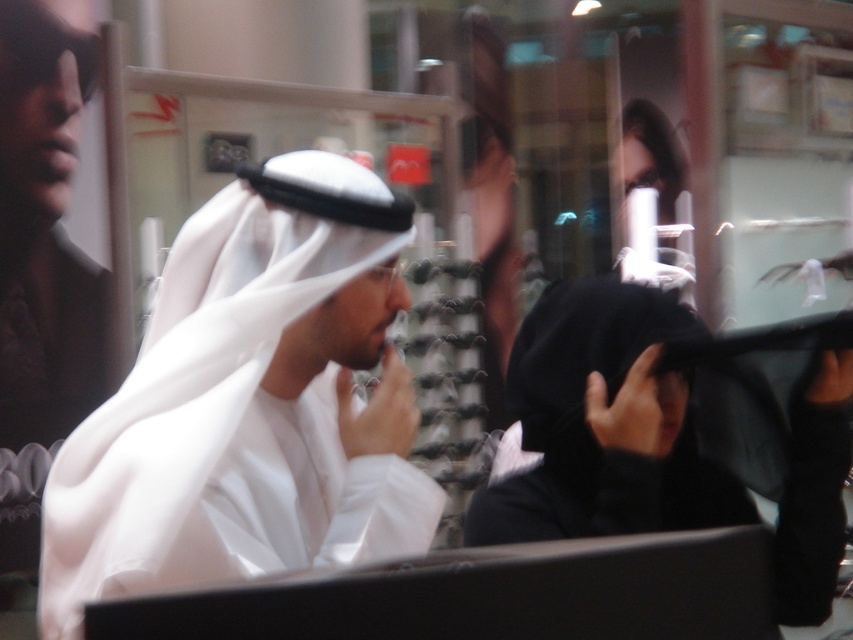
Looking at this image, based on the scene described, which object among the white matte headscarf at center and the black matte niqab at center is positioned higher up in the image?

The white matte headscarf at center is positioned higher up in the image as it is much taller than the black matte niqab at center according to the description.

You are a photographer trying to capture a closeup of the white matte headscarf at center and the black matte niqab at center. Which one should you focus on first if you want to ensure both are in focus?

The white matte headscarf at center is located above the black matte niqab at center. To ensure both are in focus, you should focus on the black matte niqab at center first since it is closer to the camera, and the depth of field will extend upward to include the white matte headscarf at center.